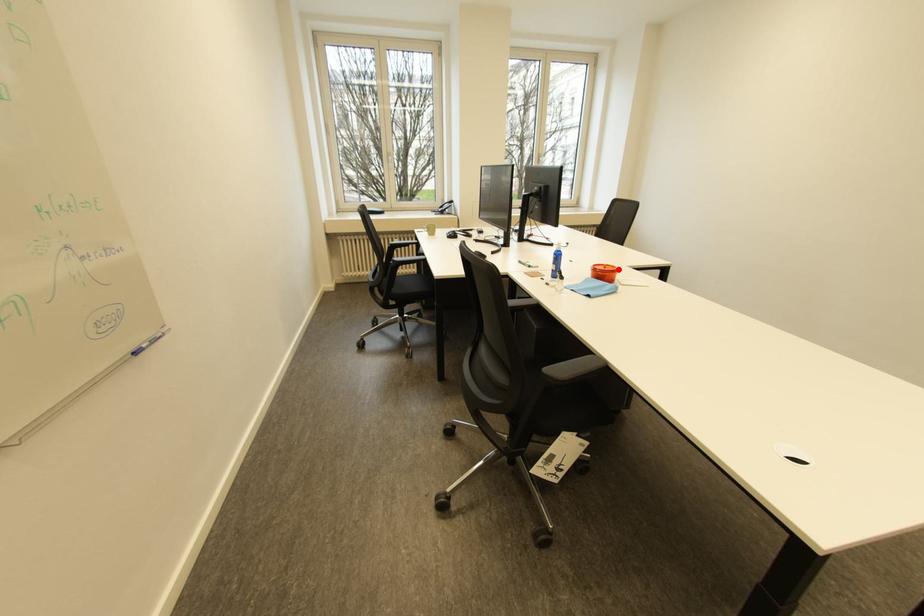
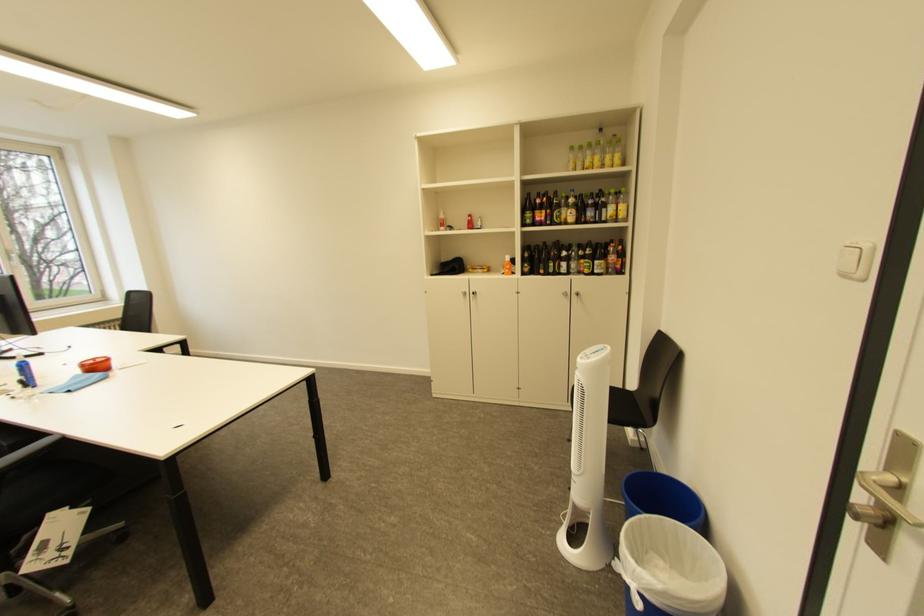
Find the pixel in the second image that matches the highlighted location in the first image.

(108, 362)